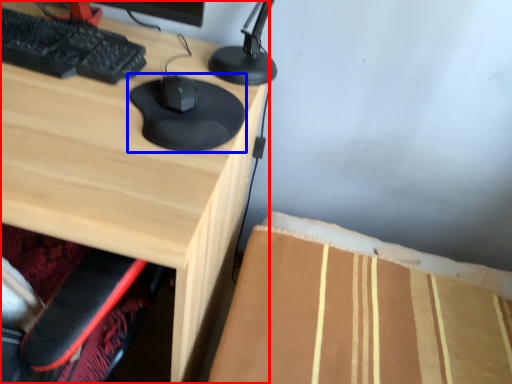
Question: Which point is closer to the camera, desk (highlighted by a red box) or mouse (highlighted by a blue box)?

Choices:
 (A) desk
 (B) mouse

Answer: (A)